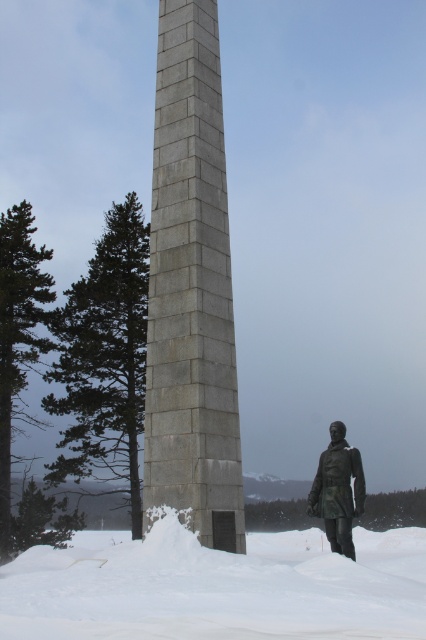
In the scene shown: Which is below, gray stone obelisk at center or white fluffy snow at lower center?

white fluffy snow at lower center

Between gray stone obelisk at center and white fluffy snow at lower center, which one appears on the right side from the viewer's perspective?

From the viewer's perspective, white fluffy snow at lower center appears more on the right side.

Between point (218, 253) and point (155, 529), which one is positioned behind?

The point (218, 253) is more distant.

The width and height of the screenshot is (426, 640). In order to click on gray stone obelisk at center in this screenshot , I will do `click(190, 291)`.

What do you see at coordinates (216, 588) in the screenshot? Image resolution: width=426 pixels, height=640 pixels. I see `white fluffy snow at lower center` at bounding box center [216, 588].

Can you confirm if white fluffy snow at lower center is bigger than bronze statue at lower right?

Indeed, white fluffy snow at lower center has a larger size compared to bronze statue at lower right.

Is point (112, 536) positioned in front of point (340, 428)?

No, (112, 536) is further to viewer.

This screenshot has width=426, height=640. I want to click on white fluffy snow at lower center, so click(216, 588).

Who is shorter, gray stone obelisk at center or bronze statue at lower right?

With less height is bronze statue at lower right.

Describe the element at coordinates (190, 291) in the screenshot. I see `gray stone obelisk at center` at that location.

Where is `gray stone obelisk at center`? The height and width of the screenshot is (640, 426). gray stone obelisk at center is located at coordinates (190, 291).